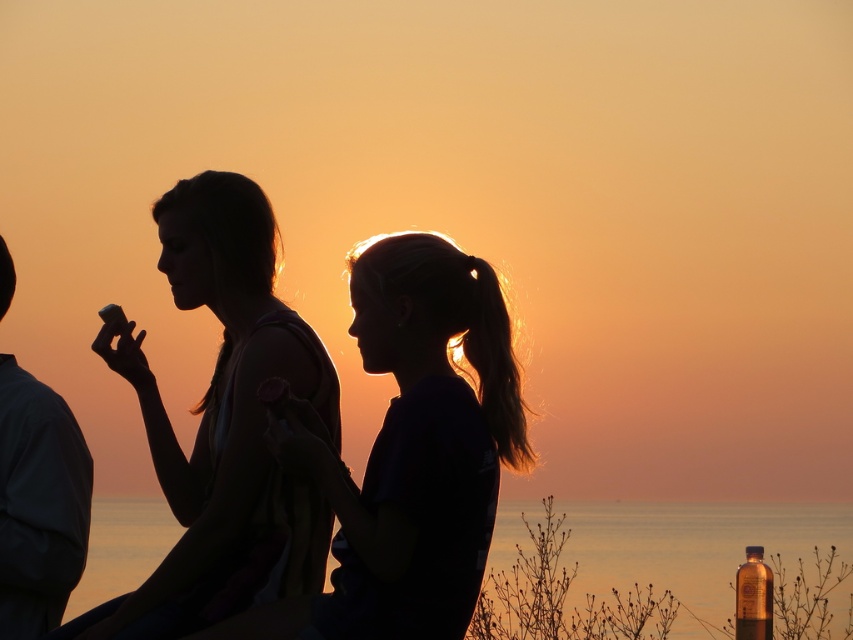
How much distance is there between silhouette fabric at center and smooth fabric shirt at left?

A distance of 1.32 meters exists between silhouette fabric at center and smooth fabric shirt at left.

Is point (262, 276) positioned in front of point (41, 458)?

No, (262, 276) is further to viewer.

Which is in front, point (231, 316) or point (0, 278)?

Point (0, 278) is more forward.

You are a GUI agent. You are given a task and a screenshot of the screen. Output one action in this format:
    pyautogui.click(x=<x>, y=<y>)
    Task: Click on the silhouette fabric at center
    
    Given the screenshot: What is the action you would take?
    pyautogui.click(x=222, y=424)

This screenshot has height=640, width=853. What are the coordinates of `silhouette fabric at center` in the screenshot? It's located at (222, 424).

Between point (224, 561) and point (735, 580), which one is positioned behind?

The point (735, 580) is behind.

This screenshot has height=640, width=853. Find the location of `silhouette fabric at center`. silhouette fabric at center is located at coordinates (222, 424).

Which is in front, point (492, 417) or point (196, 189)?

Positioned in front is point (492, 417).

Who is shorter, silhouette hair at center or silhouette fabric at center?

Standing shorter between the two is silhouette fabric at center.

Who is more forward, (477, 525) or (254, 182)?

Point (477, 525)

Where is `silhouette hair at center`? The image size is (853, 640). silhouette hair at center is located at coordinates (419, 444).